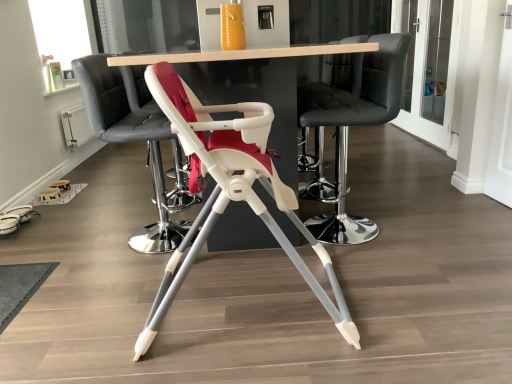
Identify the location of clear glass window screen at upper left. Image resolution: width=512 pixels, height=384 pixels. (60, 38).

This screenshot has height=384, width=512. What do you see at coordinates (230, 190) in the screenshot? I see `white plastic highchair at center, positioned as the fourth chair in back-to-front order` at bounding box center [230, 190].

What do you see at coordinates (242, 54) in the screenshot?
I see `wooden table at center` at bounding box center [242, 54].

This screenshot has height=384, width=512. Describe the element at coordinates (331, 86) in the screenshot. I see `black leather bar stool at center, the first chair from the back` at that location.

You are a GUI agent. You are given a task and a screenshot of the screen. Output one action in this format:
    pyautogui.click(x=<x>, y=<y>)
    Task: Click on the clear glass window screen at upper left
    The width and height of the screenshot is (512, 384).
    Given the screenshot: What is the action you would take?
    pyautogui.click(x=60, y=38)

From the picture: From the image's perspective, does wooden table at center appear lower than white plastic highchair at center, marked as the 3th chair in a front-to-back arrangement?

Actually, wooden table at center appears above white plastic highchair at center, marked as the 3th chair in a front-to-back arrangement, in the image.

Between wooden table at center and white plastic highchair at center, which appears as the second chair when viewed from the back, which one appears on the left side from the viewer's perspective?

From the viewer's perspective, white plastic highchair at center, which appears as the second chair when viewed from the back, appears more on the left side.

From the picture: In the image, is wooden table at center positioned in front of or behind white plastic highchair at center, which appears as the second chair when viewed from the back?

Visually, wooden table at center is located in front of white plastic highchair at center, which appears as the second chair when viewed from the back.

Find the location of a particular element. The width and height of the screenshot is (512, 384). table to the right of white plastic highchair at center, marked as the 3th chair in a front-to-back arrangement is located at coordinates (242, 54).

From the image's perspective, is clear glass window screen at upper left under white plastic highchair at center, positioned as the fourth chair in back-to-front order?

No, from the image's perspective, clear glass window screen at upper left is not beneath white plastic highchair at center, positioned as the fourth chair in back-to-front order.

In the scene shown: Who is more distant, clear glass window screen at upper left or white plastic highchair at center, which is the first chair in front-to-back order?

clear glass window screen at upper left is further away from the camera.

Would you say clear glass window screen at upper left is inside or outside white plastic highchair at center, which is the first chair in front-to-back order?

clear glass window screen at upper left is outside white plastic highchair at center, which is the first chair in front-to-back order.

Locate an element on the screen. Image resolution: width=512 pixels, height=384 pixels. chair directly beneath the white plastic highchair at center, which appears as the second chair when viewed from the back (from a real-world perspective) is located at coordinates (230, 190).

Based on the photo, is white plastic highchair at center, marked as the 3th chair in a front-to-back arrangement, located outside white plastic highchair at center, positioned as the fourth chair in back-to-front order?

Yes, white plastic highchair at center, marked as the 3th chair in a front-to-back arrangement, is located beyond the bounds of white plastic highchair at center, positioned as the fourth chair in back-to-front order.

Is white plastic highchair at center, marked as the 3th chair in a front-to-back arrangement, to the left or to the right of white plastic highchair at center, positioned as the fourth chair in back-to-front order, in the image?

From the image, it's evident that white plastic highchair at center, marked as the 3th chair in a front-to-back arrangement, is to the left of white plastic highchair at center, positioned as the fourth chair in back-to-front order.

Is clear glass window screen at upper left aimed at black leather bar stool at center, the first chair from the back?

Yes, clear glass window screen at upper left is facing black leather bar stool at center, the first chair from the back.

Based on the photo, which of these two, clear glass window screen at upper left or black leather bar stool at center, placed as the 4th chair when sorted from front to back, is thinner?

clear glass window screen at upper left is thinner.

Considering the relative positions of clear glass window screen at upper left and black leather bar stool at center, placed as the 4th chair when sorted from front to back, in the image provided, is clear glass window screen at upper left to the right of black leather bar stool at center, placed as the 4th chair when sorted from front to back, from the viewer's perspective?

No.

The width and height of the screenshot is (512, 384). Identify the location of window screen above the black leather bar stool at center, the first chair from the back (from the image's perspective). [60, 38].

Considering the sizes of objects black leather bar stool at center, placed as the 2th chair when sorted from front to back, and white plastic highchair at center, which appears as the second chair when viewed from the back, in the image provided, who is wider, black leather bar stool at center, placed as the 2th chair when sorted from front to back, or white plastic highchair at center, which appears as the second chair when viewed from the back,?

With larger width is white plastic highchair at center, which appears as the second chair when viewed from the back.

Is point (380, 87) positioned behind point (149, 245)?

That is False.

From their relative heights in the image, would you say black leather bar stool at center, arranged as the 3th chair when viewed from the back, is taller or shorter than white plastic highchair at center, marked as the 3th chair in a front-to-back arrangement?

Clearly, black leather bar stool at center, arranged as the 3th chair when viewed from the back, is taller compared to white plastic highchair at center, marked as the 3th chair in a front-to-back arrangement.

Is black leather bar stool at center, arranged as the 3th chair when viewed from the back, aimed at white plastic highchair at center, which appears as the second chair when viewed from the back?

Yes.

Between wooden table at center and black leather bar stool at center, placed as the 2th chair when sorted from front to back, which one appears on the right side from the viewer's perspective?

black leather bar stool at center, placed as the 2th chair when sorted from front to back, is more to the right.

Where is `table in front of the black leather bar stool at center, arranged as the 3th chair when viewed from the back`? table in front of the black leather bar stool at center, arranged as the 3th chair when viewed from the back is located at coordinates (242, 54).

Which is closer, (242,56) or (349,82)?

Point (242,56)

Considering the positions of objects wooden table at center and black leather bar stool at center, placed as the 2th chair when sorted from front to back, in the image provided, who is behind, wooden table at center or black leather bar stool at center, placed as the 2th chair when sorted from front to back,?

black leather bar stool at center, placed as the 2th chair when sorted from front to back, is further from the camera.

Is black leather bar stool at center, placed as the 4th chair when sorted from front to back, at the back of white plastic highchair at center, which appears as the second chair when viewed from the back?

That's not correct — white plastic highchair at center, which appears as the second chair when viewed from the back, is not looking away from black leather bar stool at center, placed as the 4th chair when sorted from front to back.

Can you confirm if white plastic highchair at center, marked as the 3th chair in a front-to-back arrangement, is positioned to the right of black leather bar stool at center, the first chair from the back?

No, white plastic highchair at center, marked as the 3th chair in a front-to-back arrangement, is not to the right of black leather bar stool at center, the first chair from the back.

Who is bigger, white plastic highchair at center, marked as the 3th chair in a front-to-back arrangement, or black leather bar stool at center, placed as the 4th chair when sorted from front to back?

With larger size is white plastic highchair at center, marked as the 3th chair in a front-to-back arrangement.

In the scene shown: Measure the distance between white plastic highchair at center, marked as the 3th chair in a front-to-back arrangement, and black leather bar stool at center, placed as the 4th chair when sorted from front to back.

white plastic highchair at center, marked as the 3th chair in a front-to-back arrangement, and black leather bar stool at center, placed as the 4th chair when sorted from front to back, are 38.03 inches apart from each other.

You are a GUI agent. You are given a task and a screenshot of the screen. Output one action in this format:
    pyautogui.click(x=<x>, y=<y>)
    Task: Click on the 2nd chair behind when counting from the wooden table at center
    
    Given the screenshot: What is the action you would take?
    (x=133, y=141)

Where is `chair that is the 2nd object to the right of the clear glass window screen at upper left, starting at the anchor`? Image resolution: width=512 pixels, height=384 pixels. chair that is the 2nd object to the right of the clear glass window screen at upper left, starting at the anchor is located at coordinates (230, 190).

Consider the image. Considering their positions, is wooden table at center positioned closer to black leather bar stool at center, arranged as the 3th chair when viewed from the back, than white plastic highchair at center, which is the first chair in front-to-back order?

The object closer to black leather bar stool at center, arranged as the 3th chair when viewed from the back, is wooden table at center.

Estimate the real-world distances between objects in this image. Which object is closer to white plastic highchair at center, which appears as the second chair when viewed from the back, white plastic highchair at center, positioned as the fourth chair in back-to-front order, or black leather bar stool at center, arranged as the 3th chair when viewed from the back?

white plastic highchair at center, positioned as the fourth chair in back-to-front order, lies closer to white plastic highchair at center, which appears as the second chair when viewed from the back, than the other object.

Which object lies nearer to the anchor point wooden table at center, clear glass window screen at upper left or black leather bar stool at center, arranged as the 3th chair when viewed from the back?

The object closer to wooden table at center is black leather bar stool at center, arranged as the 3th chair when viewed from the back.

Considering their positions, is black leather bar stool at center, arranged as the 3th chair when viewed from the back, positioned further to black leather bar stool at center, the first chair from the back, than clear glass window screen at upper left?

Based on the image, clear glass window screen at upper left appears to be further to black leather bar stool at center, the first chair from the back.

When comparing their distances from black leather bar stool at center, the first chair from the back, does white plastic highchair at center, marked as the 3th chair in a front-to-back arrangement, or wooden table at center seem closer?

The object closer to black leather bar stool at center, the first chair from the back, is wooden table at center.

Looking at the image, which one is located further to clear glass window screen at upper left, black leather bar stool at center, arranged as the 3th chair when viewed from the back, or wooden table at center?

Among the two, wooden table at center is located further to clear glass window screen at upper left.

Considering their positions, is white plastic highchair at center, marked as the 3th chair in a front-to-back arrangement, positioned further to wooden table at center than white plastic highchair at center, positioned as the fourth chair in back-to-front order?

The object further to wooden table at center is white plastic highchair at center, positioned as the fourth chair in back-to-front order.

Consider the image. From the image, which object appears to be farther from wooden table at center, white plastic highchair at center, marked as the 3th chair in a front-to-back arrangement, or black leather bar stool at center, placed as the 4th chair when sorted from front to back?

The object further to wooden table at center is white plastic highchair at center, marked as the 3th chair in a front-to-back arrangement.

The height and width of the screenshot is (384, 512). I want to click on table positioned between white plastic highchair at center, positioned as the fourth chair in back-to-front order, and black leather bar stool at center, the first chair from the back, from near to far, so click(x=242, y=54).

Where is `table between clear glass window screen at upper left and black leather bar stool at center, placed as the 4th chair when sorted from front to back`? The width and height of the screenshot is (512, 384). table between clear glass window screen at upper left and black leather bar stool at center, placed as the 4th chair when sorted from front to back is located at coordinates [x=242, y=54].

You are a GUI agent. You are given a task and a screenshot of the screen. Output one action in this format:
    pyautogui.click(x=<x>, y=<y>)
    Task: Click on the table positioned between white plastic highchair at center, which is the first chair in front-to-back order, and black leather bar stool at center, placed as the 2th chair when sorted from front to back, from near to far
    This screenshot has width=512, height=384.
    Given the screenshot: What is the action you would take?
    pyautogui.click(x=242, y=54)

Locate an element on the screen. This screenshot has height=384, width=512. table between white plastic highchair at center, which is the first chair in front-to-back order, and white plastic highchair at center, marked as the 3th chair in a front-to-back arrangement, in the front-back direction is located at coordinates (242, 54).